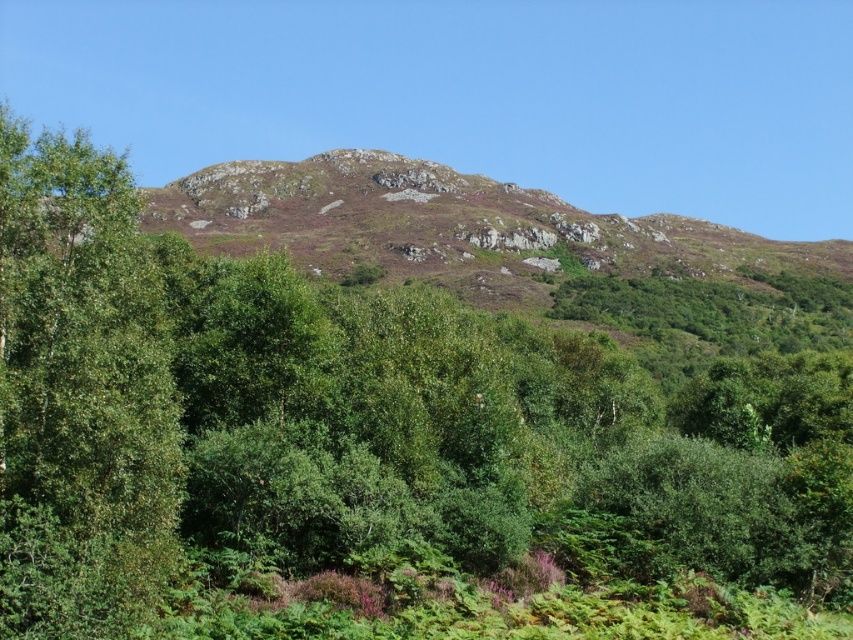
Does green leafy tree at left lie behind rusty rock mountain at center?

That is False.

Who is shorter, green leafy tree at left or rusty rock mountain at center?

green leafy tree at left is shorter.

I want to click on green leafy tree at left, so click(x=80, y=396).

Locate an element on the screen. green leafy tree at left is located at coordinates (80, 396).